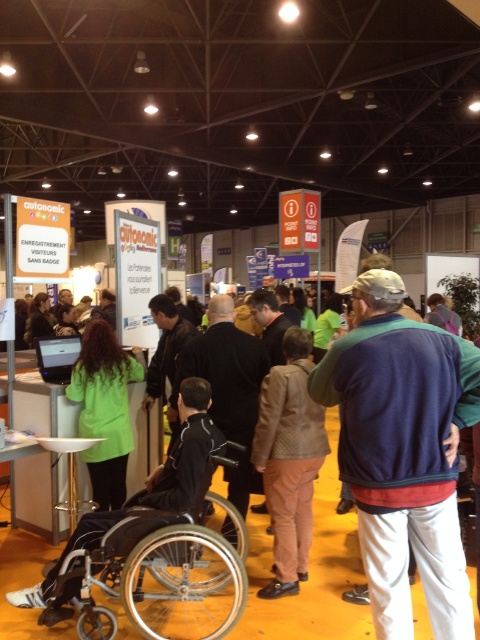
You are a visitor at the event and need to reach the registration booth. You see the silver metallic wheelchair at lower left and the green matte jacket at center. Which object is closer to the ground?

The silver metallic wheelchair at lower left is below green matte jacket at center, so it is closer to the ground.

Based on the photo, you are a person in a wheelchair trying to reach the dark blue jacket at center from the silver metallic wheelchair at lower left. Can you reach there without assistance?

The distance between the silver metallic wheelchair at lower left and the dark blue jacket at center is 28.60 inches, which is a short distance. Yes, you can reach there without assistance.

You are navigating an indoor event space and need to locate the dark blue jacket at center. According to the coordinates provided, where exactly is the dark blue jacket positioned in the image?

The dark blue jacket at center is located at the 2D coordinates point (311,572) in the image.